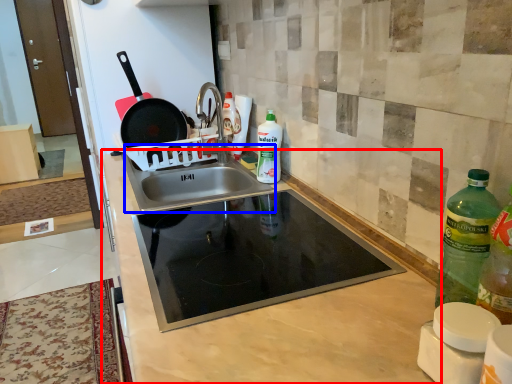
Question: Which object appears closest to the camera in this image, countertop (highlighted by a red box) or sink (highlighted by a blue box)?

Choices:
 (A) countertop
 (B) sink

Answer: (A)